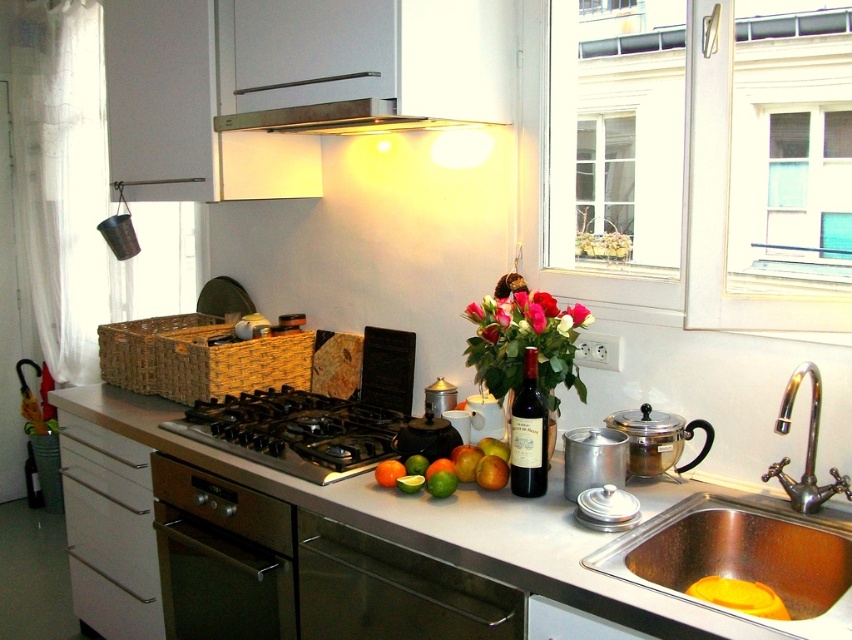
Which is below, stainless steel gas stove at center or red matte apple at center?

red matte apple at center is lower down.

Is stainless steel gas stove at center smaller than red matte apple at center?

No.

Which is behind, point (262, 406) or point (502, 483)?

Point (262, 406)

The height and width of the screenshot is (640, 852). Find the location of `stainless steel gas stove at center`. stainless steel gas stove at center is located at coordinates (294, 432).

Who is more forward, (661, 465) or (481, 440)?

Positioned in front is point (661, 465).

Locate an element on the screen. Image resolution: width=852 pixels, height=640 pixels. stainless steel teapot at right is located at coordinates (657, 440).

Measure the distance from vivid floral bouquet at center to stainless steel pot at center.

vivid floral bouquet at center and stainless steel pot at center are 9.62 inches apart.

Does vivid floral bouquet at center appear on the right side of stainless steel pot at center?

No, vivid floral bouquet at center is not to the right of stainless steel pot at center.

Does point (482, 301) lie in front of point (625, 436)?

No, it is behind (625, 436).

Find the location of a particular element. The width and height of the screenshot is (852, 640). vivid floral bouquet at center is located at coordinates (524, 339).